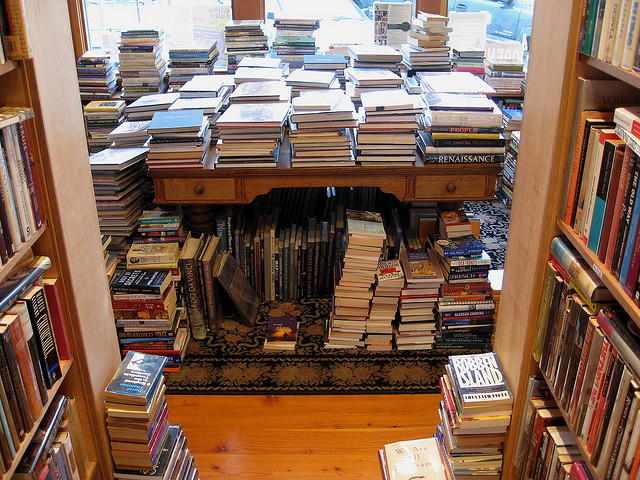
At what (x,y) coordinates should I click in order to perform the action: click on books. Please return your answer as a coordinate pair (x, y). The width and height of the screenshot is (640, 480). Looking at the image, I should click on (358, 301).